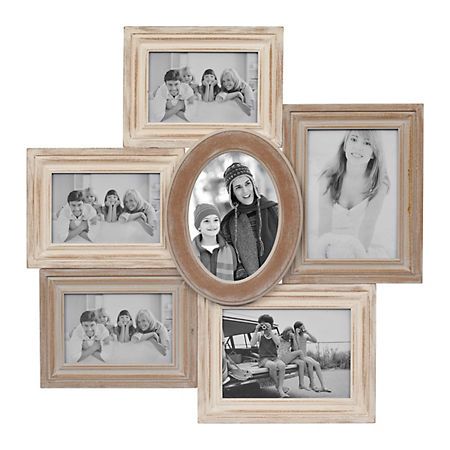
Where is `wooden frames`? This screenshot has width=450, height=450. wooden frames is located at coordinates (263, 43), (408, 114), (363, 300), (252, 141), (150, 161), (166, 282).